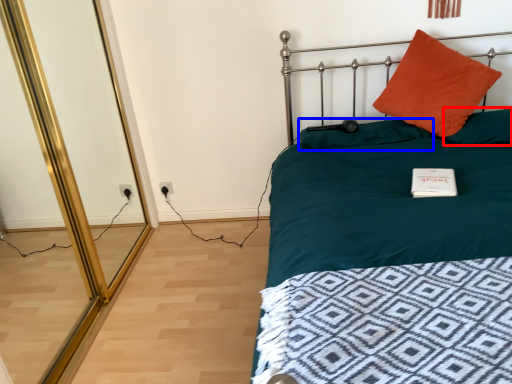
Question: Which object appears farthest to the camera in this image, pillow (highlighted by a red box) or pillow (highlighted by a blue box)?

Choices:
 (A) pillow
 (B) pillow

Answer: (B)